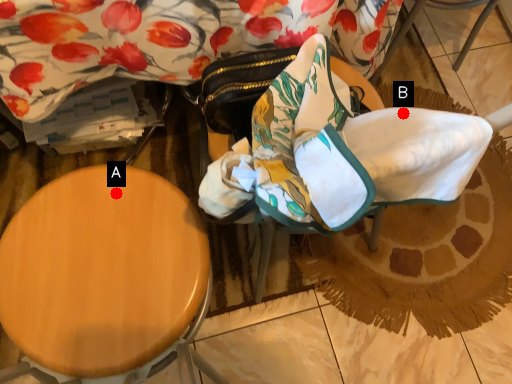
Question: Two points are circled on the image, labeled by A and B beside each circle. Which point appears farthest from the camera in this image?

Choices:
 (A) A is further
 (B) B is further

Answer: (A)